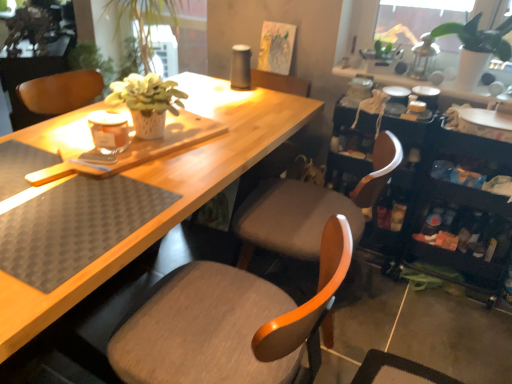
Question: Can you see matte gray chair at center, placed as the 2th chair when sorted from back to front, touching matte gray chair at center, which is the first chair in back-to-front order?

Choices:
 (A) no
 (B) yes

Answer: (A)

Question: Does matte gray chair at center, marked as the first chair in a front-to-back arrangement, come behind matte gray chair at center, which is the first chair in back-to-front order?

Choices:
 (A) no
 (B) yes

Answer: (A)

Question: From a real-world perspective, is matte gray chair at center, marked as the first chair in a front-to-back arrangement, on matte gray chair at center, which is the first chair in back-to-front order?

Choices:
 (A) no
 (B) yes

Answer: (A)

Question: Is matte gray chair at center, placed as the 2th chair when sorted from back to front, positioned with its back to matte gray chair at center, the 2th chair from the front?

Choices:
 (A) no
 (B) yes

Answer: (A)

Question: Does matte gray chair at center, placed as the 2th chair when sorted from back to front, have a lesser width compared to matte gray chair at center, the 2th chair from the front?

Choices:
 (A) yes
 (B) no

Answer: (B)

Question: Would you say matte gray chair at center, the 2th chair from the front, is inside or outside black rubber placemat at lower left?

Choices:
 (A) outside
 (B) inside

Answer: (A)

Question: Considering the positions of matte gray chair at center, the 2th chair from the front, and black rubber placemat at lower left in the image, is matte gray chair at center, the 2th chair from the front, taller or shorter than black rubber placemat at lower left?

Choices:
 (A) tall
 (B) short

Answer: (A)

Question: Considering their positions, is matte gray chair at center, the 2th chair from the front, located in front of or behind black rubber placemat at lower left?

Choices:
 (A) front
 (B) behind

Answer: (B)

Question: Looking at their shapes, would you say matte gray chair at center, the 2th chair from the front, is wider or thinner than black rubber placemat at lower left?

Choices:
 (A) wide
 (B) thin

Answer: (A)

Question: Is point (307, 311) closer or farther from the camera than point (138, 198)?

Choices:
 (A) closer
 (B) farther

Answer: (A)

Question: In terms of width, does matte gray chair at center, placed as the 2th chair when sorted from back to front, look wider or thinner when compared to black rubber placemat at lower left?

Choices:
 (A) thin
 (B) wide

Answer: (B)

Question: Based on their positions, is matte gray chair at center, marked as the first chair in a front-to-back arrangement, located to the left or right of black rubber placemat at lower left?

Choices:
 (A) right
 (B) left

Answer: (A)

Question: In terms of height, does matte gray chair at center, placed as the 2th chair when sorted from back to front, look taller or shorter compared to black rubber placemat at lower left?

Choices:
 (A) short
 (B) tall

Answer: (B)

Question: Is matte gray chair at center, which is the first chair in back-to-front order, wider or thinner than white matte plant pot at upper right?

Choices:
 (A) thin
 (B) wide

Answer: (B)

Question: In the image, is matte gray chair at center, the 2th chair from the front, on the left side or the right side of white matte plant pot at upper right?

Choices:
 (A) right
 (B) left

Answer: (B)